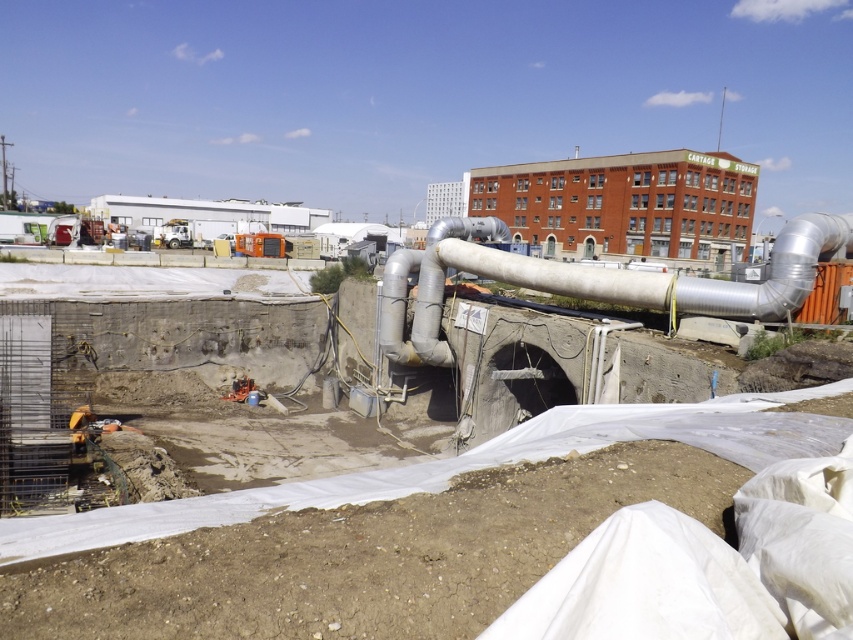
Which is behind, point (685, 417) or point (578, 273)?

Positioned behind is point (578, 273).

Can you confirm if concrete wall at center is positioned to the left of silver metallic pipe at center?

Yes, concrete wall at center is to the left of silver metallic pipe at center.

Does point (700, 444) come closer to viewer compared to point (398, 324)?

Yes.

The image size is (853, 640). Find the location of `concrete wall at center`. concrete wall at center is located at coordinates (469, 465).